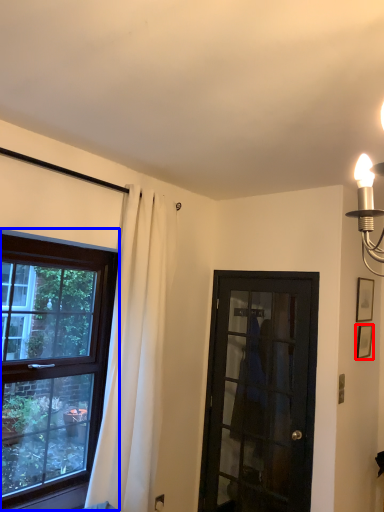
Question: Which point is closer to the camera, picture frame (highlighted by a red box) or window (highlighted by a blue box)?

Choices:
 (A) picture frame
 (B) window

Answer: (B)